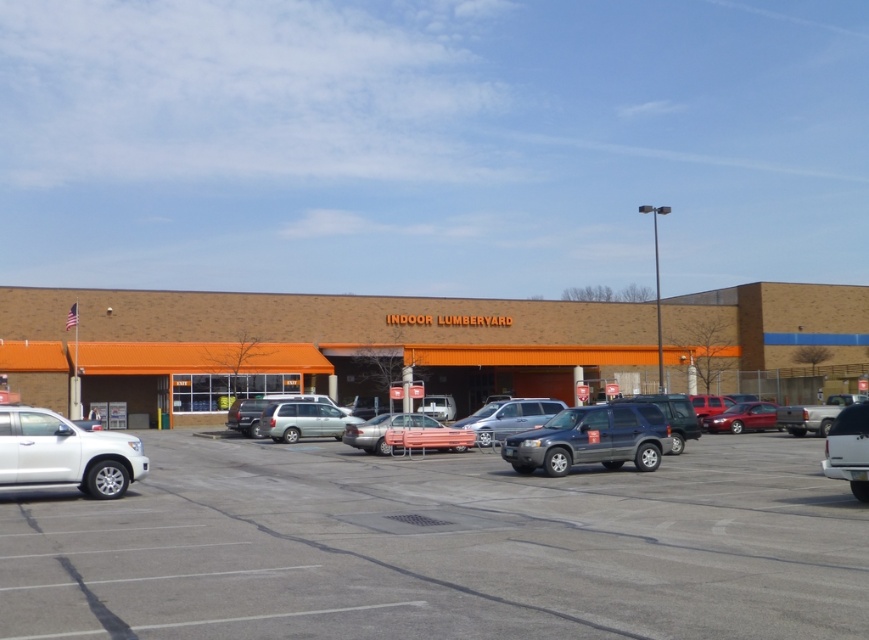
Is metallic silver car at center to the right of satin silver minivan at center from the viewer's perspective?

Yes, metallic silver car at center is to the right of satin silver minivan at center.

In the scene shown: Does metallic silver car at center appear on the left side of satin silver minivan at center?

In fact, metallic silver car at center is to the right of satin silver minivan at center.

Is point (456, 429) positioned in front of point (313, 403)?

Yes.

I want to click on metallic silver car at center, so click(x=402, y=433).

Which is below, gray asphalt parking lot at center or brown brick mall at center?

Positioned lower is gray asphalt parking lot at center.

Does gray asphalt parking lot at center have a larger size compared to brown brick mall at center?

No.

Between point (767, 556) and point (240, 298), which one is positioned behind?

Point (240, 298)

Locate an element on the screen. Image resolution: width=869 pixels, height=640 pixels. gray asphalt parking lot at center is located at coordinates tap(441, 547).

Is white matte suv at lower left taller than matte gray suv at center?

Incorrect, white matte suv at lower left's height is not larger of matte gray suv at center's.

Who is more forward, (7, 476) or (611, 417)?

Positioned in front is point (7, 476).

You are a GUI agent. You are given a task and a screenshot of the screen. Output one action in this format:
    pyautogui.click(x=<x>, y=<y>)
    Task: Click on the white matte suv at lower left
    The width and height of the screenshot is (869, 640).
    Given the screenshot: What is the action you would take?
    pyautogui.click(x=65, y=452)